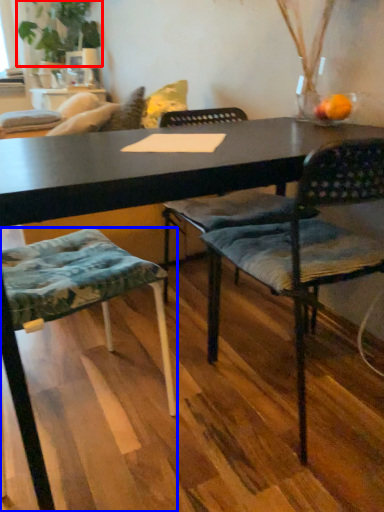
Question: Which point is closer to the camera, plant (highlighted by a red box) or chair (highlighted by a blue box)?

Choices:
 (A) plant
 (B) chair

Answer: (B)